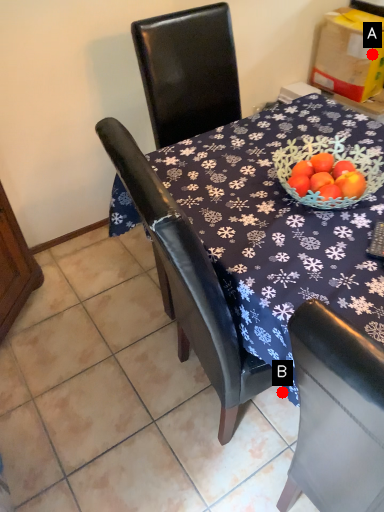
Question: Two points are circled on the image, labeled by A and B beside each circle. Which point is closer to the camera?

Choices:
 (A) A is closer
 (B) B is closer

Answer: (B)